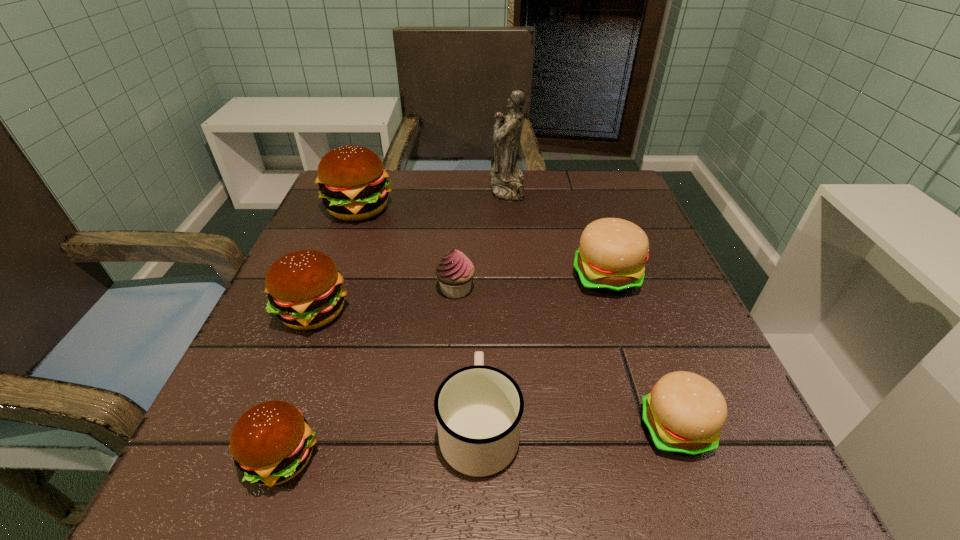
At what (x,y) coordinates should I click in order to perform the action: click on free space between the smallest brown hamburger and the farthest hamburger. Please return your answer as a coordinate pair (x, y). This screenshot has height=540, width=960. Looking at the image, I should click on (320, 334).

Find the location of a particular element. This screenshot has width=960, height=540. object that is the closest to the smaller beige hamburger is located at coordinates (478, 408).

Select which object is the sixth closest to the smaller beige hamburger. Please provide its 2D coordinates. Your answer should be formatted as a tuple, i.e. [(x, y)], where the tuple contains the x and y coordinates of a point satisfying the conditions above.

[(507, 183)]

Point out which hamburger is positioned as the second nearest to the nearer beige hamburger. Please provide its 2D coordinates. Your answer should be formatted as a tuple, i.e. [(x, y)], where the tuple contains the x and y coordinates of a point satisfying the conditions above.

[(271, 443)]

At what (x,y) coordinates should I click in order to perform the action: click on the closest hamburger to the nearer beige hamburger. Please return your answer as a coordinate pair (x, y). The image size is (960, 540). Looking at the image, I should click on (610, 260).

Locate an element on the screen. This screenshot has height=540, width=960. brown hamburger that is the closest to the second biggest brown hamburger is located at coordinates (x=271, y=443).

Locate which brown hamburger ranks second in proximity to the second smallest brown hamburger. Please provide its 2D coordinates. Your answer should be formatted as a tuple, i.e. [(x, y)], where the tuple contains the x and y coordinates of a point satisfying the conditions above.

[(352, 180)]

Find the location of a particular element. The width and height of the screenshot is (960, 540). blank area in the image that satisfies the following two spatial constraints: 1. on the back side of the farther beige hamburger; 2. on the left side of the second farthest brown hamburger is located at coordinates (326, 278).

Where is `free spot that satisfies the following two spatial constraints: 1. on the back side of the smaller beige hamburger; 2. on the front-facing side of the tallest object`? Image resolution: width=960 pixels, height=540 pixels. free spot that satisfies the following two spatial constraints: 1. on the back side of the smaller beige hamburger; 2. on the front-facing side of the tallest object is located at coordinates (588, 188).